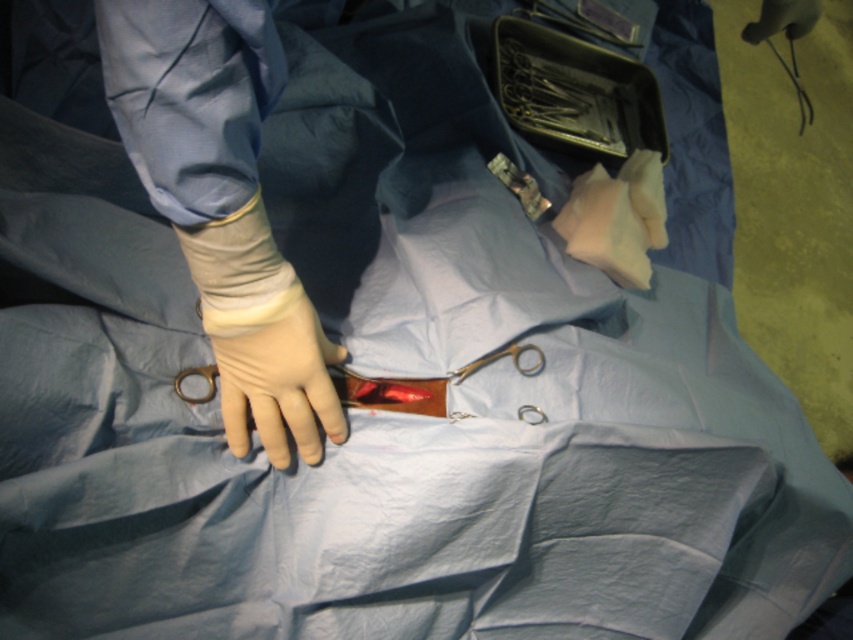
From the picture: Can you confirm if metallic silver surgical instruments at upper right is wider than rubber glove at center?

Correct, the width of metallic silver surgical instruments at upper right exceeds that of rubber glove at center.

Locate an element on the screen. This screenshot has height=640, width=853. metallic silver surgical instruments at upper right is located at coordinates (575, 93).

The width and height of the screenshot is (853, 640). I want to click on metallic silver surgical instruments at upper right, so click(x=575, y=93).

The height and width of the screenshot is (640, 853). I want to click on beige rubber glove at left, so click(x=222, y=202).

Is beige rubber glove at left below metallic silver surgical instruments at upper right?

Correct, beige rubber glove at left is located below metallic silver surgical instruments at upper right.

Who is more distant from viewer, (175, 28) or (553, 115)?

The point (553, 115) is more distant.

You are a GUI agent. You are given a task and a screenshot of the screen. Output one action in this format:
    pyautogui.click(x=<x>, y=<y>)
    Task: Click on the beige rubber glove at left
    
    Given the screenshot: What is the action you would take?
    pyautogui.click(x=222, y=202)

Does point (248, 70) come closer to viewer compared to point (216, 333)?

Yes, it is in front of point (216, 333).

Does point (171, 42) come behind point (212, 308)?

No, (171, 42) is closer to viewer.

Which is in front, point (231, 106) or point (229, 326)?

Point (231, 106) is in front.

You are a GUI agent. You are given a task and a screenshot of the screen. Output one action in this format:
    pyautogui.click(x=<x>, y=<y>)
    Task: Click on the beige rubber glove at left
    This screenshot has width=853, height=640.
    Given the screenshot: What is the action you would take?
    pyautogui.click(x=222, y=202)